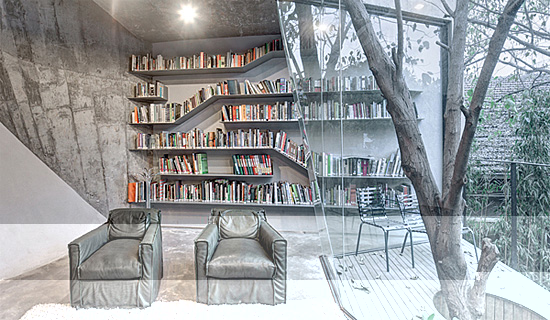
Locate an element on the screen. chair is located at coordinates (x=236, y=257).